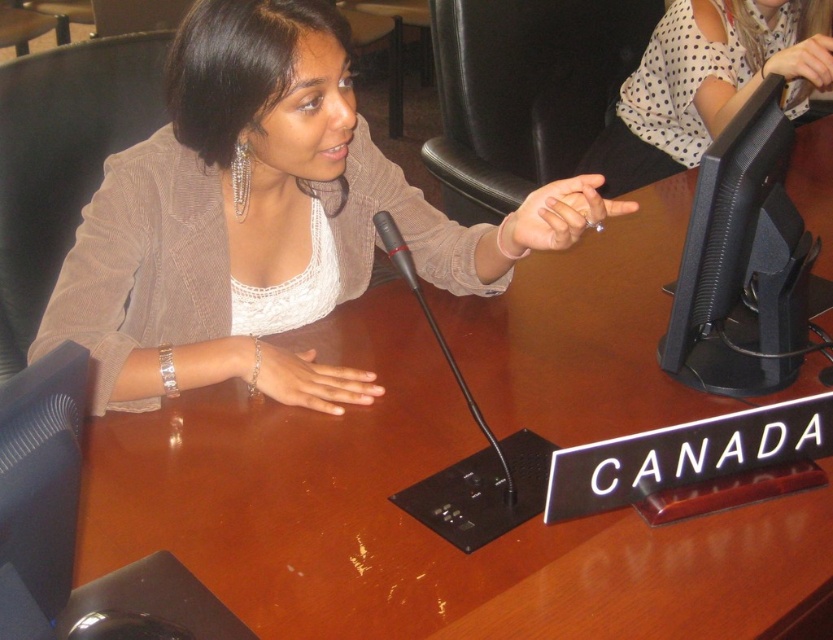
Which of these two, brown polished wood table at center or matte black hand at upper right, stands shorter?

Standing shorter between the two is matte black hand at upper right.

Does point (302, 340) come farther from viewer compared to point (812, 74)?

No, (302, 340) is closer to viewer.

Is point (190, 538) behind point (791, 76)?

No, it is in front of (791, 76).

The image size is (833, 640). In order to click on brown polished wood table at center in this screenshot , I will do `click(417, 522)`.

Who is higher up, black plastic monitor at right or light skin tone flesh at center?

black plastic monitor at right

Is black plastic monitor at right above light skin tone flesh at center?

Indeed, black plastic monitor at right is positioned over light skin tone flesh at center.

Does point (731, 346) lie in front of point (323, 378)?

That is True.

This screenshot has height=640, width=833. I want to click on black plastic monitor at right, so click(742, 262).

Who is positioned more to the right, brown polished wood table at center or black plastic monitor at right?

Positioned to the right is brown polished wood table at center.

Is brown polished wood table at center bigger than black plastic monitor at right?

Yes, brown polished wood table at center is bigger than black plastic monitor at right.

Is point (547, 576) positioned after point (722, 317)?

No, (547, 576) is closer to viewer.

The image size is (833, 640). I want to click on brown polished wood table at center, so click(x=417, y=522).